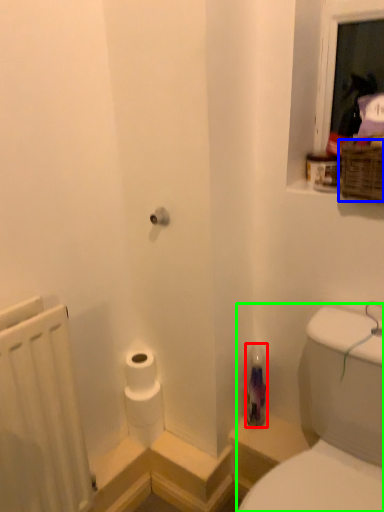
Question: Estimate the real-world distances between objects in this image. Which object is closer to bottle (highlighted by a red box), basket (highlighted by a blue box) or sink (highlighted by a green box)?

Choices:
 (A) basket
 (B) sink

Answer: (B)